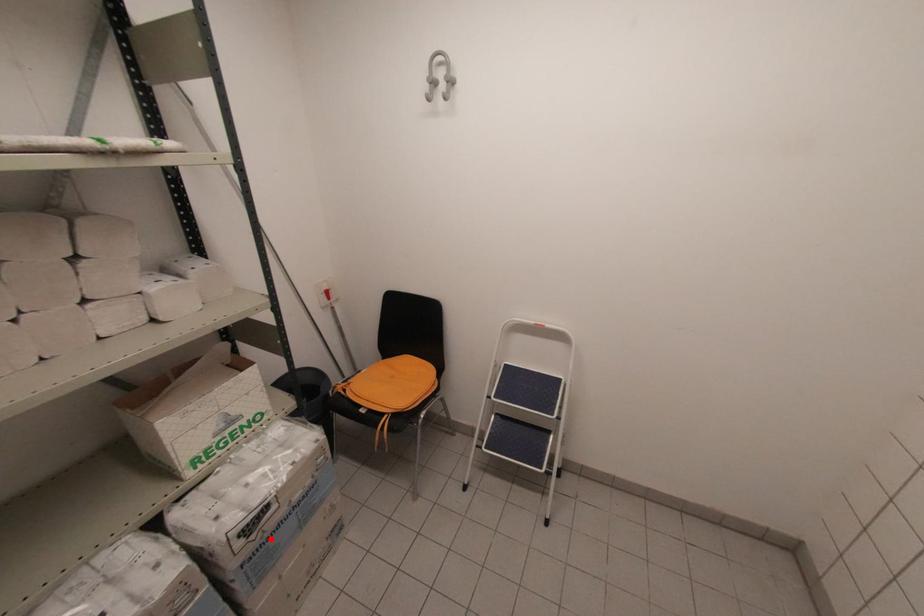
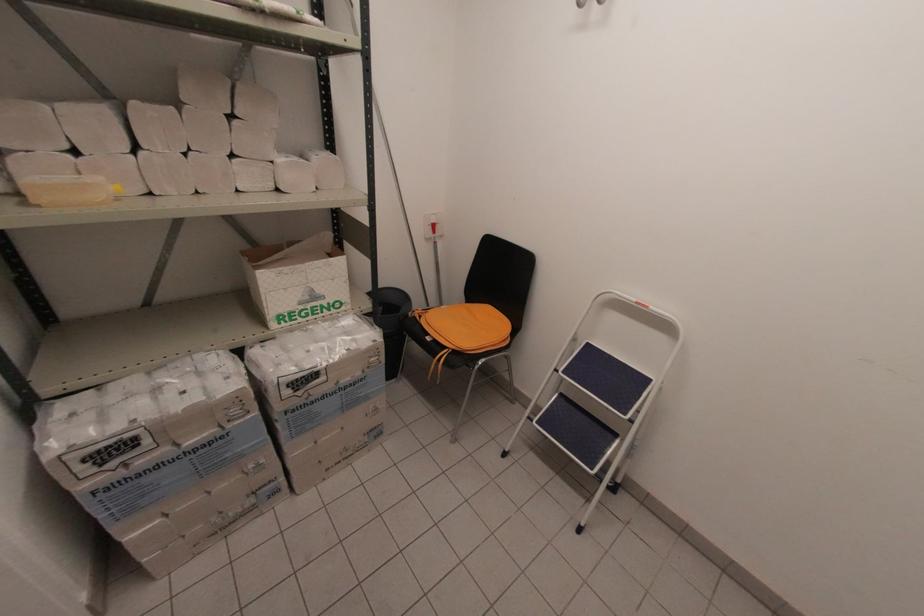
Locate, in the second image, the point that corresponds to the highlighted location in the first image.

(312, 403)